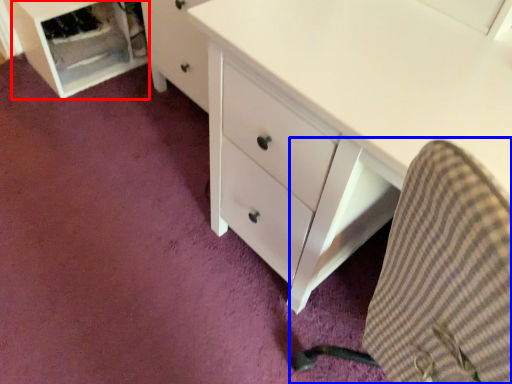
Question: Which of the following is the farthest to the observer, file cabinet (highlighted by a red box) or computer chair (highlighted by a blue box)?

Choices:
 (A) file cabinet
 (B) computer chair

Answer: (A)